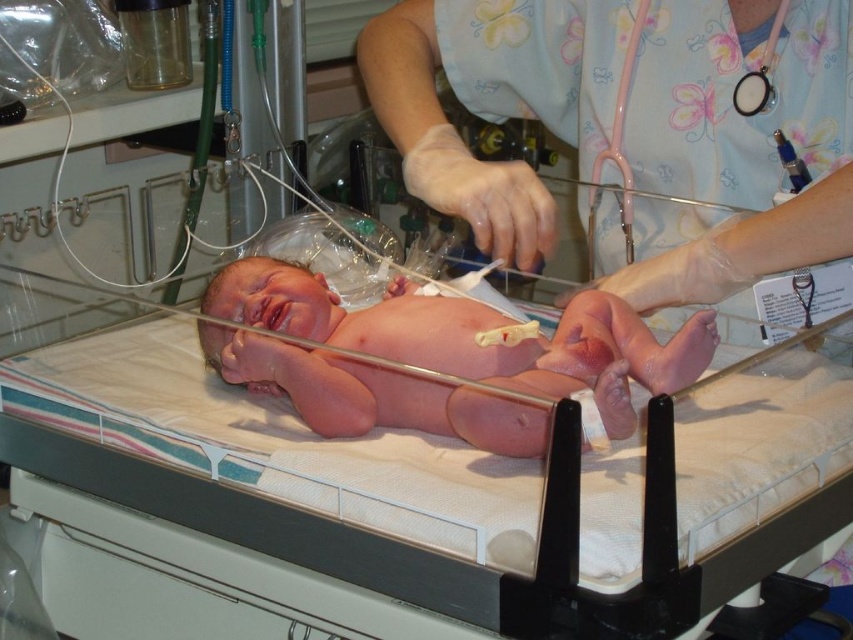
You are a medical professional in the NICU. You need to place a sensor on the baby for monitoring. There are two points available for placement. One is at point (419, 193) and the other is at point (608, 141). Based on their positions, which point is closer to the baby?

Point (419, 193) is in front of point (608, 141), so the sensor placed at point (419, 193) would be closer to the baby.

You are a nurse in the NICU and need to locate the pink rubber stethoscope at upper right. Where should you look relative to the pink floral scrubs at center?

The pink rubber stethoscope at upper right is on the right side of the pink floral scrubs at center.